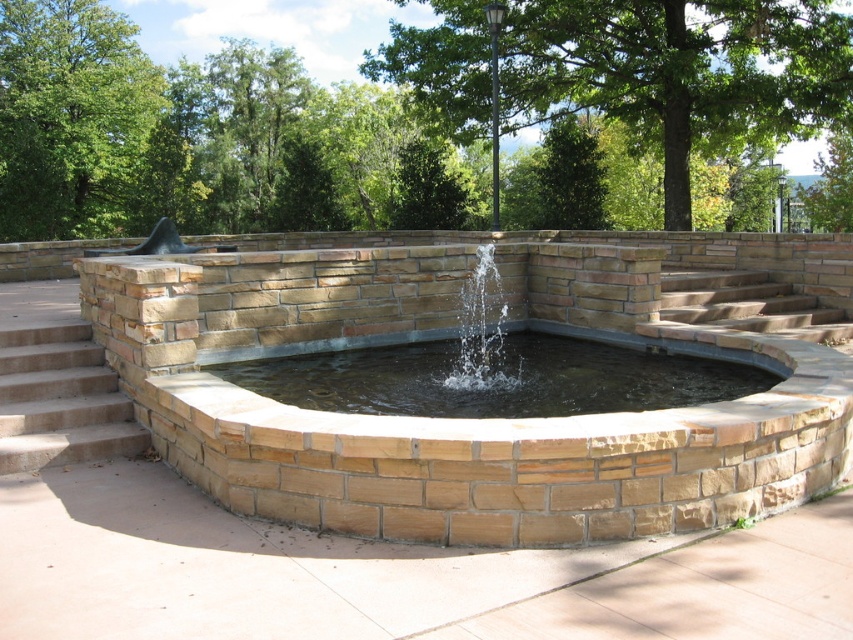
Question: Which of the following is the closest to the observer?

Choices:
 (A) concrete stairs at lower left
 (B) clear water fountain at center
 (C) clear stone pool at center
 (D) brown stone fountain at center

Answer: (D)

Question: Is brown stone fountain at center to the left of concrete stairs at lower left from the viewer's perspective?

Choices:
 (A) yes
 (B) no

Answer: (B)

Question: Does brown stone fountain at center have a lesser width compared to concrete stairs at lower left?

Choices:
 (A) yes
 (B) no

Answer: (A)

Question: Estimate the real-world distances between objects in this image. Which object is farther from the clear water fountain at center?

Choices:
 (A) brown stone fountain at center
 (B) clear stone pool at center
 (C) concrete stairs at lower left

Answer: (A)

Question: Is brown stone fountain at center to the right of clear stone pool at center from the viewer's perspective?

Choices:
 (A) yes
 (B) no

Answer: (A)

Question: Which of the following is the farthest from the observer?

Choices:
 (A) tap(462, 381)
 (B) tap(122, 452)

Answer: (A)